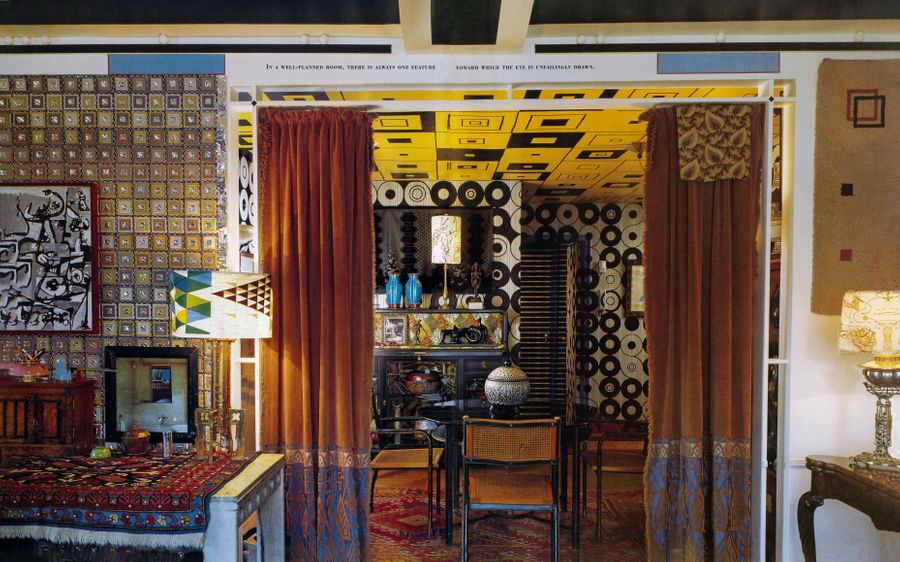
Image resolution: width=900 pixels, height=562 pixels. I want to click on table lamp, so click(x=217, y=402), click(x=452, y=251), click(x=878, y=391).